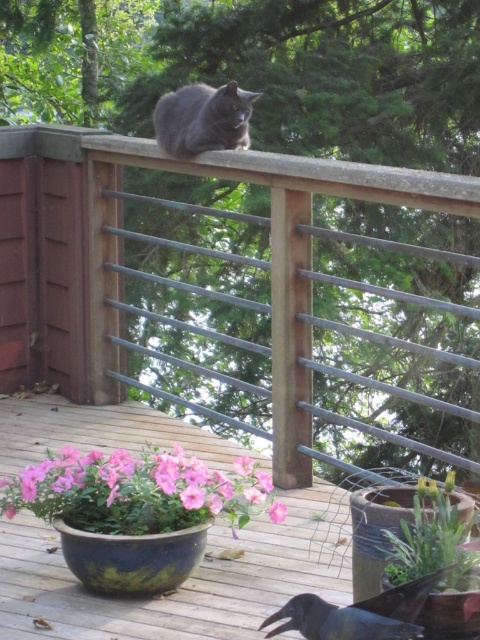
You are standing at the center of the wooden deck and want to place a new plant pot exactly where the pink matte flower pot at lower left is currently located. According to the coordinates provided, what are the exact coordinates where you should place the new pot?

The coordinates for the pink matte flower pot at lower left are point (135,492), so you should place the new pot at those exact coordinates.

You are a gardener who wants to water the pink matte flower at center. You see the pink matte flower pot at lower left nearby. Is the pot above or below the flower?

The pink matte flower pot at lower left is positioned over the pink matte flower at center, so the pot is above the flower.